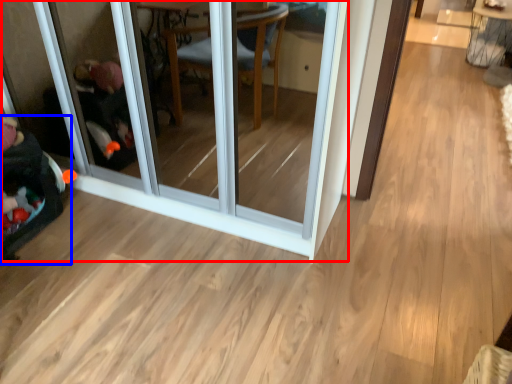
Question: Which object appears closest to the camera in this image, screen door (highlighted by a red box) or baby carriage (highlighted by a blue box)?

Choices:
 (A) screen door
 (B) baby carriage

Answer: (A)